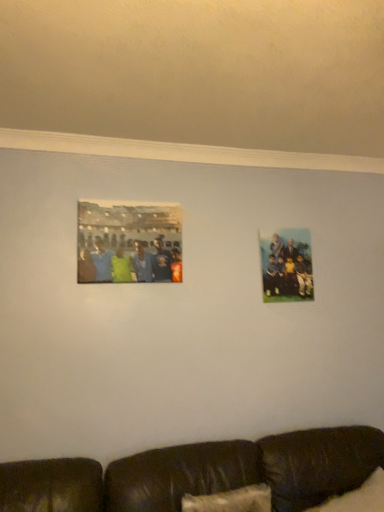
Question: From the image's perspective, is matte plastic photo frame at upper left, which appears as the second picture frame when viewed from the back, below brown leather couch at lower center?

Choices:
 (A) yes
 (B) no

Answer: (B)

Question: Is matte plastic photo frame at upper left, the 2th picture frame viewed from the right, looking in the opposite direction of brown leather couch at lower center?

Choices:
 (A) yes
 (B) no

Answer: (B)

Question: Does matte plastic photo frame at upper left, which appears as the second picture frame when viewed from the back, appear on the right side of brown leather couch at lower center?

Choices:
 (A) no
 (B) yes

Answer: (A)

Question: From a real-world perspective, is matte plastic photo frame at upper left, which appears as the second picture frame when viewed from the back, below brown leather couch at lower center?

Choices:
 (A) no
 (B) yes

Answer: (A)

Question: From the image's perspective, would you say matte plastic photo frame at upper left, placed as the 1th picture frame when sorted from left to right, is positioned over brown leather couch at lower center?

Choices:
 (A) yes
 (B) no

Answer: (A)

Question: Is matte plastic photo frame at right, which is counted as the 2th picture frame, starting from the front, to the left or to the right of matte plastic photo frame at upper left, the 2th picture frame viewed from the right, in the image?

Choices:
 (A) right
 (B) left

Answer: (A)

Question: In the image, is matte plastic photo frame at right, the second picture frame viewed from the left, positioned in front of or behind matte plastic photo frame at upper left, the first picture frame positioned from the front?

Choices:
 (A) front
 (B) behind

Answer: (B)

Question: From a real-world perspective, is matte plastic photo frame at right, the first picture frame from the back, physically located above or below matte plastic photo frame at upper left, which appears as the second picture frame when viewed from the back?

Choices:
 (A) below
 (B) above

Answer: (A)

Question: Is matte plastic photo frame at right, acting as the 1th picture frame starting from the right, situated inside matte plastic photo frame at upper left, placed as the 1th picture frame when sorted from left to right, or outside?

Choices:
 (A) outside
 (B) inside

Answer: (A)

Question: From a real-world perspective, is white fluffy pillow at lower right positioned above or below matte plastic photo frame at upper left, the first picture frame positioned from the front?

Choices:
 (A) above
 (B) below

Answer: (B)

Question: In terms of width, does white fluffy pillow at lower right look wider or thinner when compared to matte plastic photo frame at upper left, the first picture frame positioned from the front?

Choices:
 (A) thin
 (B) wide

Answer: (B)

Question: Choose the correct answer: Is white fluffy pillow at lower right inside matte plastic photo frame at upper left, the first picture frame positioned from the front, or outside it?

Choices:
 (A) inside
 (B) outside

Answer: (B)

Question: Considering the positions of white fluffy pillow at lower right and matte plastic photo frame at upper left, which appears as the second picture frame when viewed from the back, in the image, is white fluffy pillow at lower right bigger or smaller than matte plastic photo frame at upper left, which appears as the second picture frame when viewed from the back,?

Choices:
 (A) big
 (B) small

Answer: (A)

Question: Is white fluffy pillow at lower right wider or thinner than matte plastic photo frame at right, which is counted as the 2th picture frame, starting from the front?

Choices:
 (A) thin
 (B) wide

Answer: (B)

Question: From the image's perspective, relative to matte plastic photo frame at right, the second picture frame viewed from the left, is white fluffy pillow at lower right above or below?

Choices:
 (A) above
 (B) below

Answer: (B)